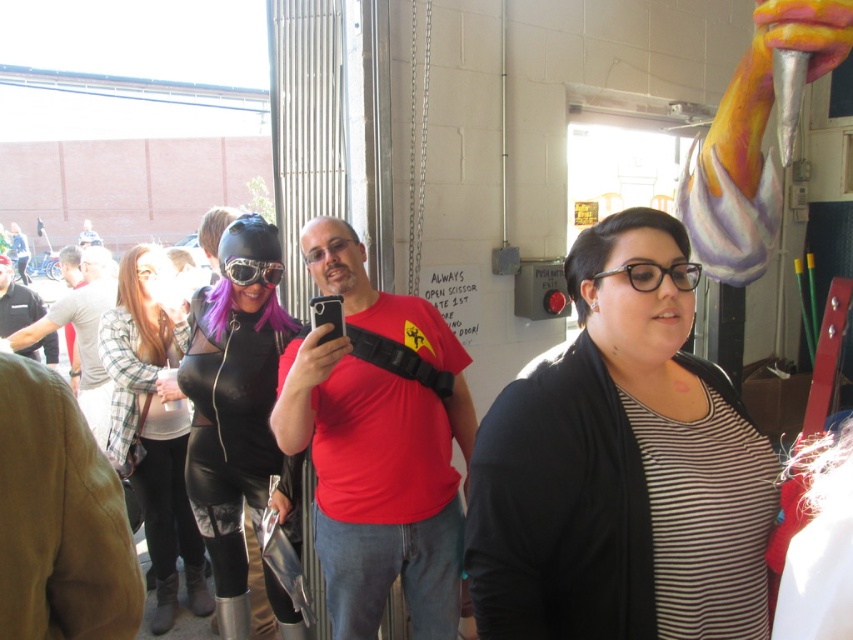
Question: Which point appears closest to the camera in this image?

Choices:
 (A) (276, 406)
 (B) (39, 339)
 (C) (677, 253)

Answer: (C)

Question: Which of the following is the closest to the observer?

Choices:
 (A) matte red t-shirt at center
 (B) matte gray shirt at left
 (C) black leather bodysuit at center

Answer: (A)

Question: Does leather jacket at center have a greater width compared to metallic silver goggles at center?

Choices:
 (A) yes
 (B) no

Answer: (A)

Question: Does matte gray shirt at left come behind metallic silver goggles at center?

Choices:
 (A) no
 (B) yes

Answer: (B)

Question: Can you confirm if matte gray shirt at left is thinner than metallic silver goggles at center?

Choices:
 (A) no
 (B) yes

Answer: (A)

Question: Which point is farther from the camera taking this photo?

Choices:
 (A) (97, 308)
 (B) (224, 260)
 (C) (245, 609)

Answer: (A)